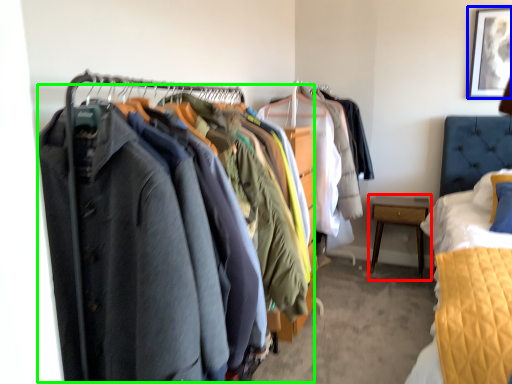
Question: Based on their relative distances, which object is nearer to nightstand (highlighted by a red box)? Choose from picture frame (highlighted by a blue box) and closet (highlighted by a green box).

Choices:
 (A) picture frame
 (B) closet

Answer: (A)